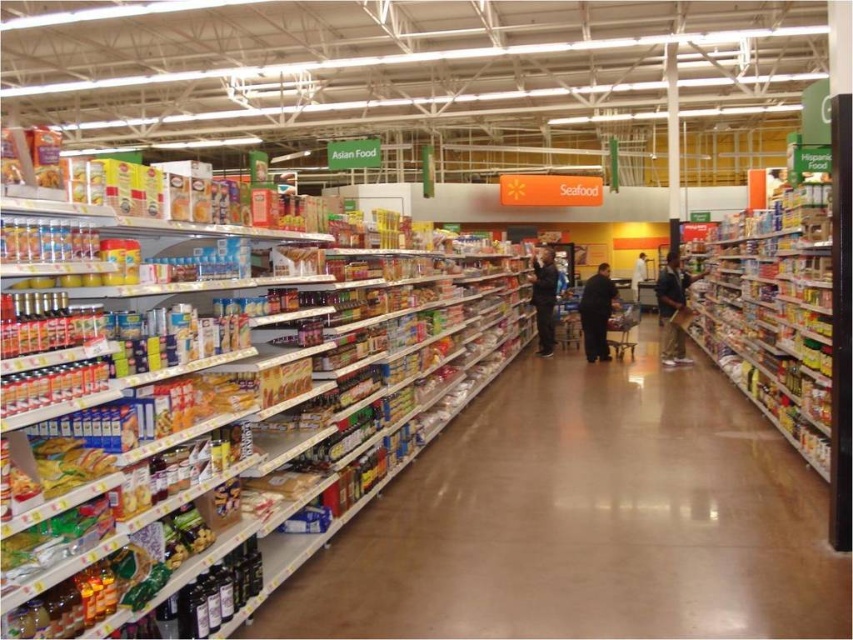
You are a customer in the supermarket and you see a dark blue shirt at center and a dark blue jeans at center. Which item is smaller in size?

The dark blue shirt at center is smaller than the dark blue jeans at center.